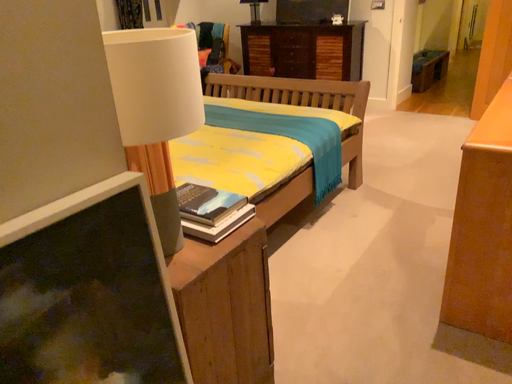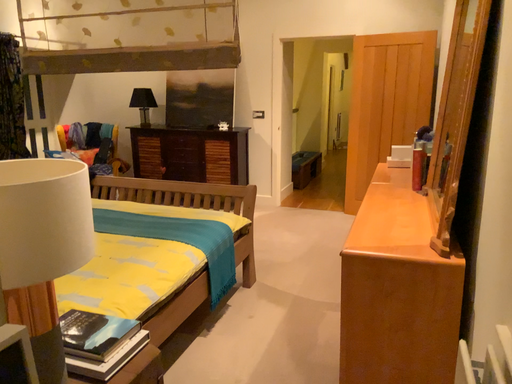
Question: Which way did the camera rotate in the video?

Choices:
 (A) rotated right
 (B) rotated left

Answer: (A)